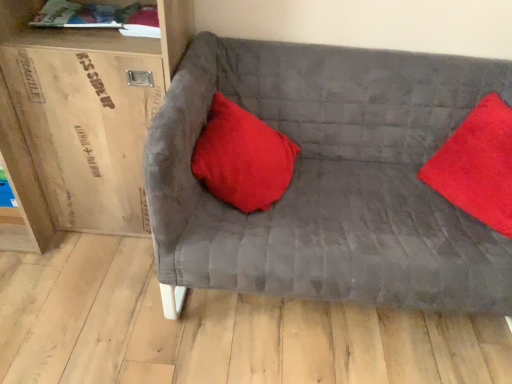
The height and width of the screenshot is (384, 512). Identify the location of empty space that is ontop of hardcover book at upper left. (80, 6).